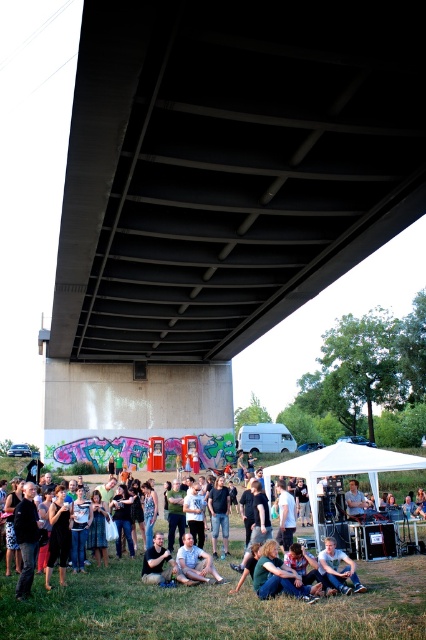
This screenshot has height=640, width=426. What are the coordinates of `green grass at lower center` in the screenshot? It's located at (215, 608).

Which is below, white fabric tent at center or denim shorts at lower center?

white fabric tent at center is lower down.

Is white fabric tent at center wider than denim shorts at lower center?

Indeed, white fabric tent at center has a greater width compared to denim shorts at lower center.

Is point (342, 474) positioned in front of point (206, 573)?

No, it is behind (206, 573).

Identify the location of white fabric tent at center. point(340,468).

Is point (319, 554) farther from viewer compared to point (351, 486)?

No, (319, 554) is in front of (351, 486).

Describe the element at coordinates (337, 566) in the screenshot. I see `denim jeans at lower center` at that location.

Between point (354, 586) and point (365, 508), which one is positioned behind?

The point (365, 508) is more distant.

Where is `denim jeans at lower center`? This screenshot has height=640, width=426. denim jeans at lower center is located at coordinates (337, 566).